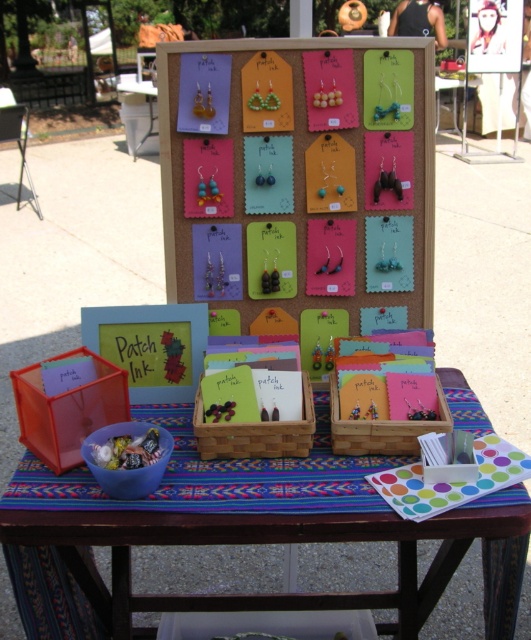
Is translucent plastic candy container at lower left below black matte tank top at upper center?

Correct, translucent plastic candy container at lower left is located below black matte tank top at upper center.

Looking at this image, is translucent plastic candy container at lower left bigger than black matte tank top at upper center?

Incorrect, translucent plastic candy container at lower left is not larger than black matte tank top at upper center.

Is point (200, 596) positioned in front of point (439, 28)?

Yes, point (200, 596) is closer to viewer.

The image size is (531, 640). What are the coordinates of `translucent plastic candy container at lower left` in the screenshot? It's located at (219, 490).